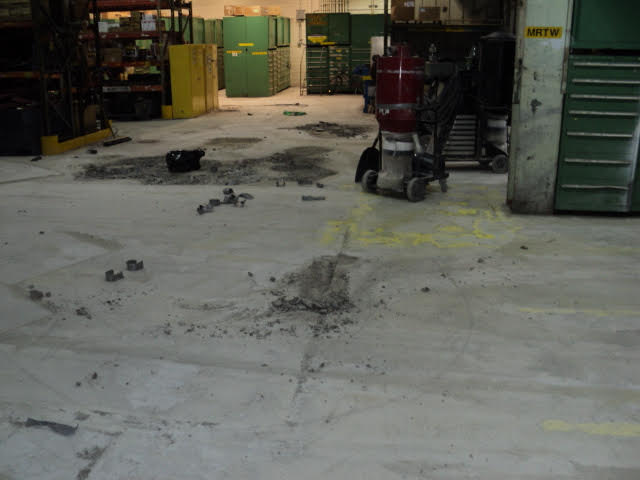
I want to click on boxes, so click(x=403, y=12), click(x=433, y=10), click(x=118, y=54), click(x=132, y=21), click(x=89, y=115).